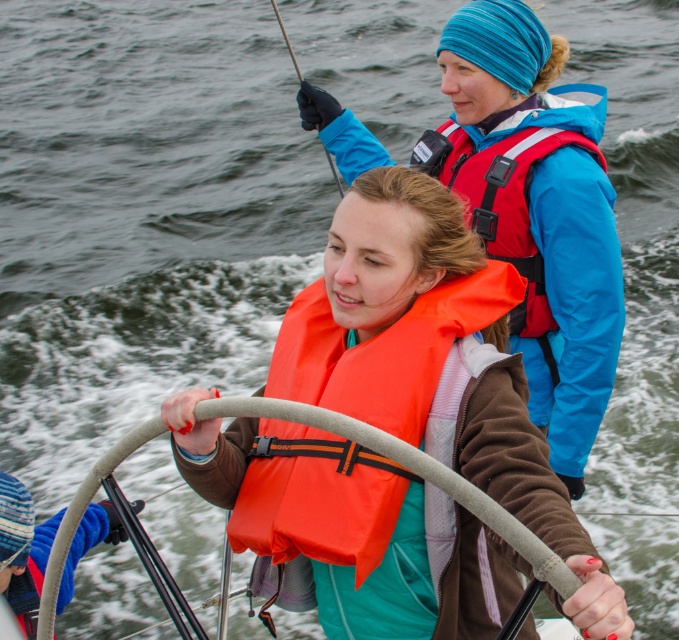
Is orange life vest at center shorter than orange matte life jacket at center?

No, orange life vest at center is not shorter than orange matte life jacket at center.

Consider the image. Can you confirm if orange life vest at center is positioned above orange matte life jacket at center?

Yes.

This screenshot has width=679, height=640. What do you see at coordinates (540, 212) in the screenshot?
I see `orange life vest at center` at bounding box center [540, 212].

Locate an element on the screen. The width and height of the screenshot is (679, 640). orange life vest at center is located at coordinates (540, 212).

Is orange matte life jacket at center behind orange matte life jacket at upper center?

No, it is not.

Based on the photo, between orange matte life jacket at center and orange matte life jacket at upper center, which one appears on the left side from the viewer's perspective?

orange matte life jacket at center

Describe the element at coordinates (384, 349) in the screenshot. This screenshot has width=679, height=640. I see `orange matte life jacket at center` at that location.

Locate an element on the screen. This screenshot has height=640, width=679. orange matte life jacket at center is located at coordinates (384, 349).

Who is positioned more to the right, orange matte life jacket at upper center or blue fleece glove at center?

orange matte life jacket at upper center

Between point (504, 148) and point (91, 506), which one is positioned behind?

The point (91, 506) is more distant.

Which is behind, point (475, 157) or point (48, 545)?

Positioned behind is point (475, 157).

You are a GUI agent. You are given a task and a screenshot of the screen. Output one action in this format:
    pyautogui.click(x=<x>, y=<y>)
    Task: Click on the orange matte life jacket at upper center
    The image size is (679, 640).
    Given the screenshot: What is the action you would take?
    pyautogui.click(x=500, y=198)